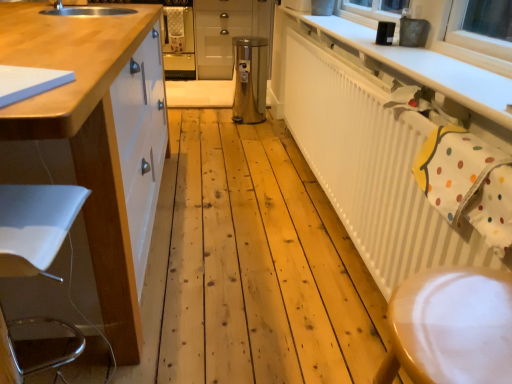
What are the coordinates of `free point above white textured radiator at upper right (from a real-world perspective)` in the screenshot? It's located at (362, 64).